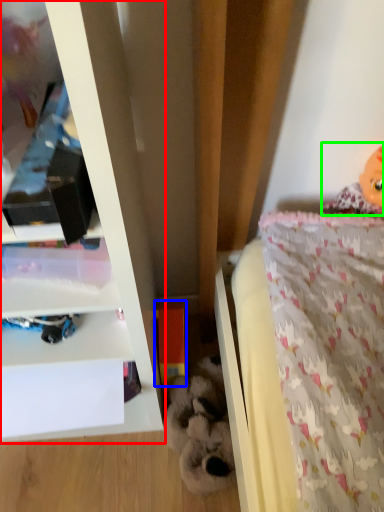
Question: Which object is positioned closest to shelf (highlighted by a red box)? Select from toy (highlighted by a blue box) and doll (highlighted by a green box).

Choices:
 (A) toy
 (B) doll

Answer: (A)